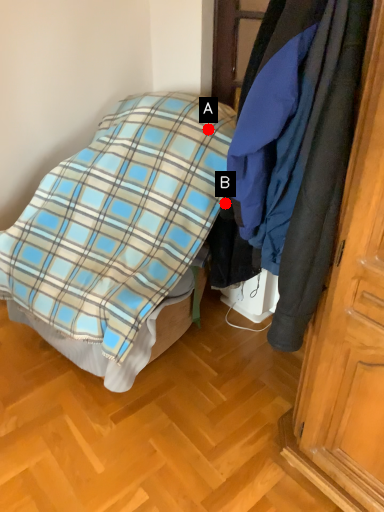
Question: Two points are circled on the image, labeled by A and B beside each circle. Which point appears farthest from the camera in this image?

Choices:
 (A) A is further
 (B) B is further

Answer: (A)